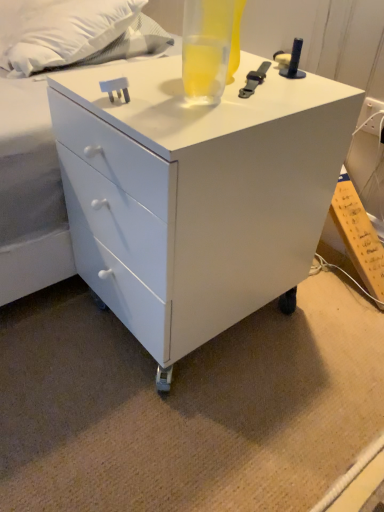
Question: Should I look upward or downward to see white soft pillow at upper left?

Choices:
 (A) up
 (B) down

Answer: (A)

Question: Is translucent glass beverage at top far from white soft pillow at upper left?

Choices:
 (A) yes
 (B) no

Answer: (B)

Question: Would you say white soft pillow at upper left is part of translucent glass beverage at top's contents?

Choices:
 (A) yes
 (B) no

Answer: (B)

Question: Does translucent glass beverage at top have a lesser width compared to white soft pillow at upper left?

Choices:
 (A) no
 (B) yes

Answer: (B)

Question: Does translucent glass beverage at top have a greater height compared to white soft pillow at upper left?

Choices:
 (A) yes
 (B) no

Answer: (B)

Question: From a real-world perspective, is translucent glass beverage at top on top of white soft pillow at upper left?

Choices:
 (A) yes
 (B) no

Answer: (A)

Question: Is translucent glass beverage at top directly adjacent to white soft pillow at upper left?

Choices:
 (A) no
 (B) yes

Answer: (A)

Question: Could you tell me if white glossy chest of drawers at center is turned towards translucent glass beverage at top?

Choices:
 (A) no
 (B) yes

Answer: (A)

Question: From a real-world perspective, is white glossy chest of drawers at center physically below translucent glass beverage at top?

Choices:
 (A) no
 (B) yes

Answer: (B)

Question: Is white glossy chest of drawers at center taller than translucent glass beverage at top?

Choices:
 (A) yes
 (B) no

Answer: (A)

Question: Are white glossy chest of drawers at center and translucent glass beverage at top located far from each other?

Choices:
 (A) no
 (B) yes

Answer: (A)

Question: Does white glossy chest of drawers at center have a smaller size compared to translucent glass beverage at top?

Choices:
 (A) no
 (B) yes

Answer: (A)

Question: From the image's perspective, is white glossy chest of drawers at center over translucent glass beverage at top?

Choices:
 (A) no
 (B) yes

Answer: (A)

Question: Is white glossy chest of drawers at center located within translucent glass beverage at top?

Choices:
 (A) yes
 (B) no

Answer: (B)